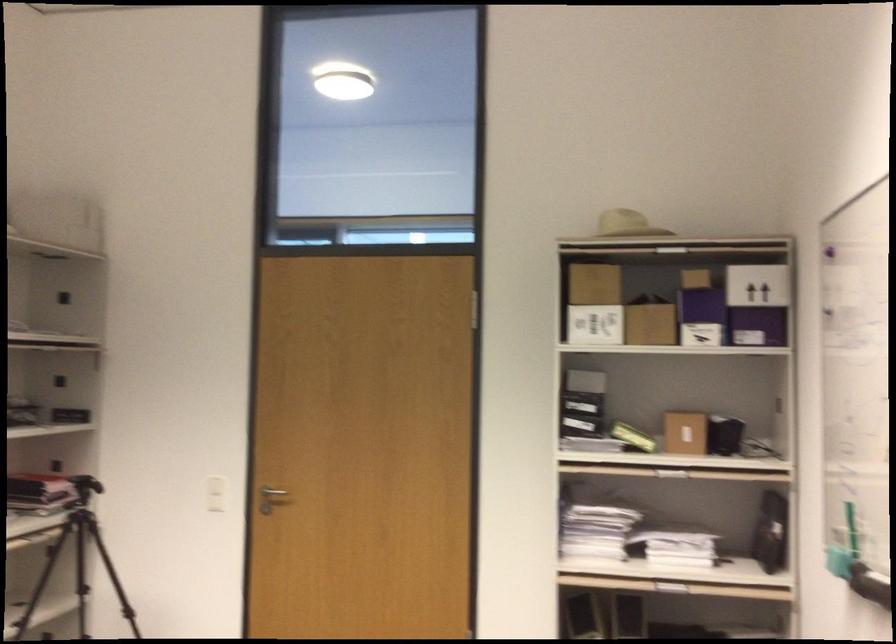
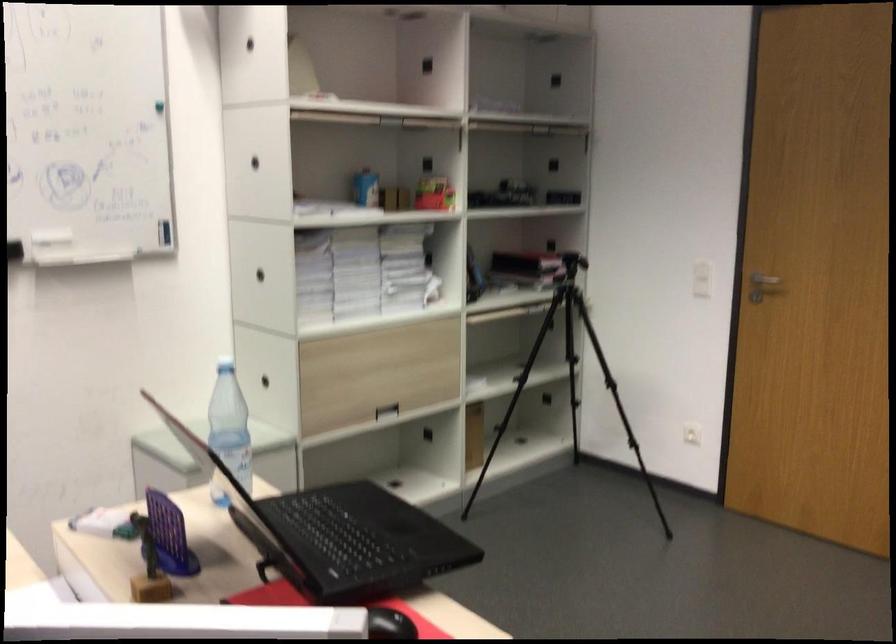
Question: Based on the continuous images, in which direction is the camera rotating? Reply with the corresponding letter.

Choices:
 (A) Left
 (B) Right
 (C) Up
 (D) Down

Answer: (A)